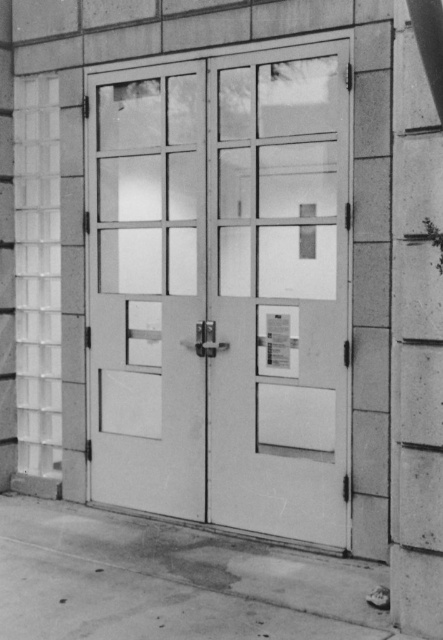
You are standing in front of the double doors. You need to locate the matte glass door at center. According to the coordinates, where exactly is it positioned?

The matte glass door at center is positioned at coordinates point (147,291).

You are a delivery person trying to enter through the clear glass door at center. There is a smooth concrete pillar at right blocking your path. Can you walk around the pillar to reach the door?

The clear glass door at center is above the smooth concrete pillar at right, which means the pillar is below the door. Since the pillar is at the right side, you can walk around it to reach the door.